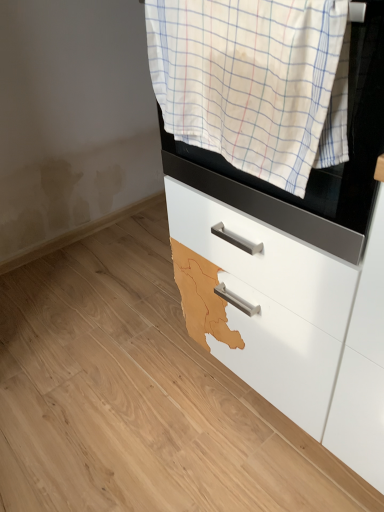
Question: From a real-world perspective, is white glossy drawer at center located beneath white checkered towel at upper center?

Choices:
 (A) no
 (B) yes

Answer: (B)

Question: Is the surface of white glossy drawer at center in direct contact with white checkered towel at upper center?

Choices:
 (A) yes
 (B) no

Answer: (B)

Question: Would you say white glossy drawer at center contains white checkered towel at upper center?

Choices:
 (A) no
 (B) yes

Answer: (A)

Question: Is the depth of white glossy drawer at center less than that of white checkered towel at upper center?

Choices:
 (A) yes
 (B) no

Answer: (B)

Question: Considering the relative positions of white glossy drawer at center and white checkered towel at upper center in the image provided, is white glossy drawer at center to the left of white checkered towel at upper center from the viewer's perspective?

Choices:
 (A) yes
 (B) no

Answer: (B)

Question: Does white glossy drawer at center have a larger size compared to white checkered towel at upper center?

Choices:
 (A) no
 (B) yes

Answer: (B)

Question: Can you confirm if white checkered towel at upper center is thinner than white glossy drawer at center?

Choices:
 (A) no
 (B) yes

Answer: (B)

Question: Considering the relative sizes of white checkered towel at upper center and white glossy drawer at center in the image provided, is white checkered towel at upper center smaller than white glossy drawer at center?

Choices:
 (A) no
 (B) yes

Answer: (B)

Question: Is white checkered towel at upper center taller than white glossy drawer at center?

Choices:
 (A) yes
 (B) no

Answer: (B)

Question: Is white checkered towel at upper center aimed at white glossy drawer at center?

Choices:
 (A) yes
 (B) no

Answer: (B)

Question: Is white checkered towel at upper center oriented away from white glossy drawer at center?

Choices:
 (A) yes
 (B) no

Answer: (B)

Question: Is white checkered towel at upper center placed right next to white glossy drawer at center?

Choices:
 (A) yes
 (B) no

Answer: (B)

Question: Considering the positions of white checkered towel at upper center and white glossy drawer at center in the image, is white checkered towel at upper center wider or thinner than white glossy drawer at center?

Choices:
 (A) thin
 (B) wide

Answer: (A)